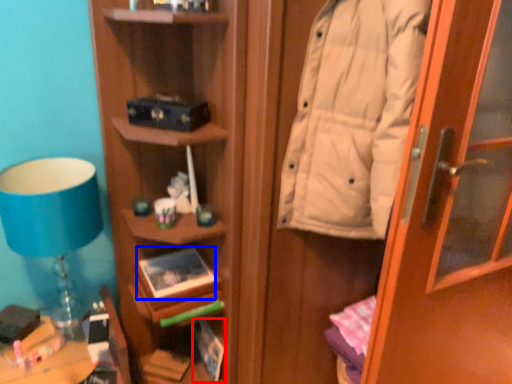
Question: Which object appears closest to the camera in this image, book (highlighted by a red box) or book (highlighted by a blue box)?

Choices:
 (A) book
 (B) book

Answer: (B)